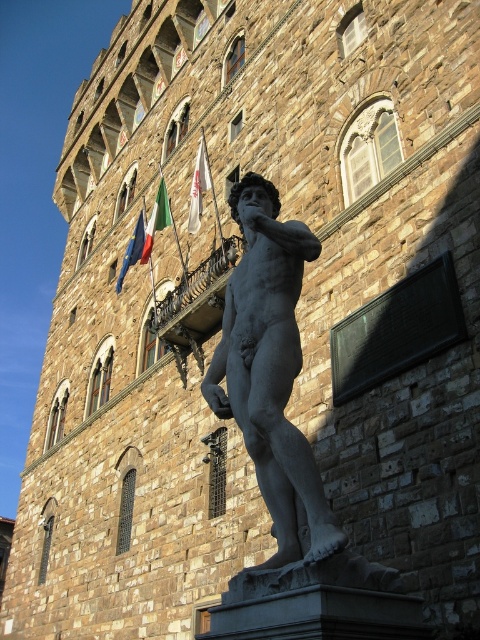
Can you confirm if green fabric flag at upper center is bigger than blue fabric flag at upper left?

Yes, green fabric flag at upper center is bigger than blue fabric flag at upper left.

Between green fabric flag at upper center and blue fabric flag at upper left, which one has less height?

Standing shorter between the two is blue fabric flag at upper left.

Describe the element at coordinates (156, 220) in the screenshot. This screenshot has width=480, height=640. I see `green fabric flag at upper center` at that location.

Locate an element on the screen. This screenshot has width=480, height=640. green fabric flag at upper center is located at coordinates (156, 220).

Is matte gray statue at center thinner than blue fabric flag at upper left?

No.

Locate an element on the screen. Image resolution: width=480 pixels, height=640 pixels. matte gray statue at center is located at coordinates [269, 369].

Is matte gray statue at center shorter than green fabric flag at upper center?

Incorrect, matte gray statue at center's height does not fall short of green fabric flag at upper center's.

Between point (229, 204) and point (162, 221), which one is positioned in front?

Positioned in front is point (229, 204).

You are a GUI agent. You are given a task and a screenshot of the screen. Output one action in this format:
    pyautogui.click(x=<x>, y=<y>)
    Task: Click on the matte gray statue at center
    Image resolution: width=480 pixels, height=640 pixels.
    Given the screenshot: What is the action you would take?
    pyautogui.click(x=269, y=369)